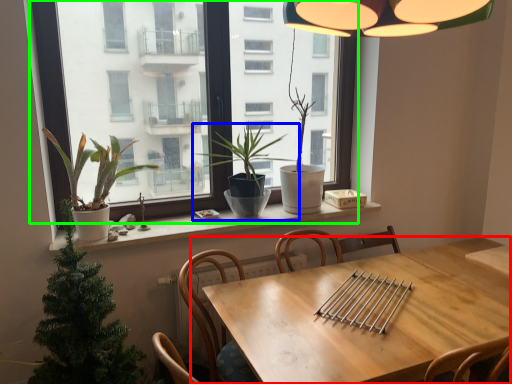
Question: Based on their relative distances, which object is farther from table (highlighted by a red box)? Choose from houseplant (highlighted by a blue box) and window (highlighted by a green box).

Choices:
 (A) houseplant
 (B) window

Answer: (B)